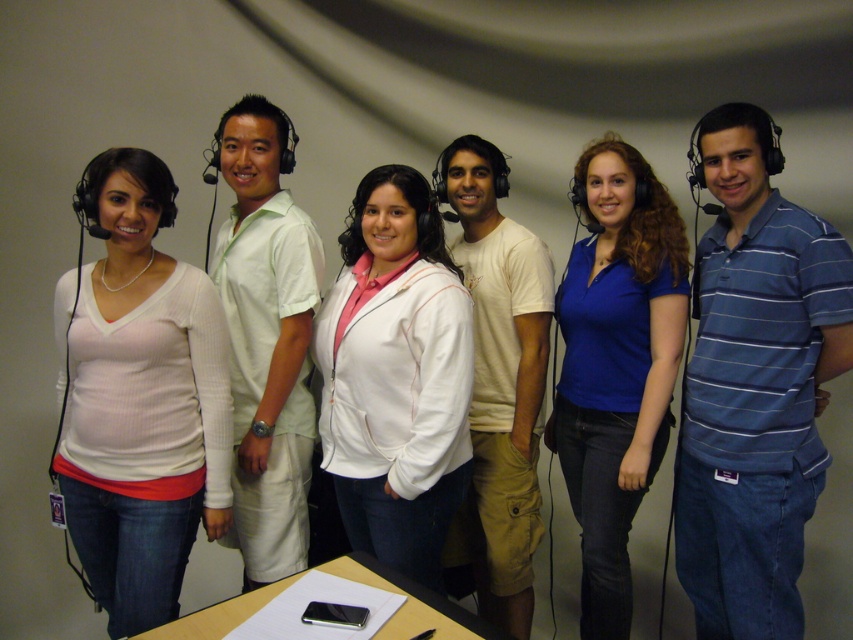
Question: Which point is closer to the camera?

Choices:
 (A) light beige cotton t-shirt at center
 (B) blue striped polo shirt at right

Answer: (B)

Question: From the image, what is the correct spatial relationship of blue striped polo shirt at right in relation to black matte microphone at upper center?

Choices:
 (A) below
 (B) above

Answer: (A)

Question: Is blue striped polo shirt at right thinner than black matte microphone at upper center?

Choices:
 (A) no
 (B) yes

Answer: (A)

Question: Which point appears farthest from the camera in this image?

Choices:
 (A) (705, 204)
 (B) (596, 204)
 (C) (189, 618)
 (D) (111, 502)

Answer: (A)

Question: Is light green shirt at center above black matte microphone at upper center?

Choices:
 (A) no
 (B) yes

Answer: (A)

Question: Which object appears farthest from the camera in this image?

Choices:
 (A) smooth wooden table at center
 (B) light beige cotton t-shirt at center

Answer: (B)